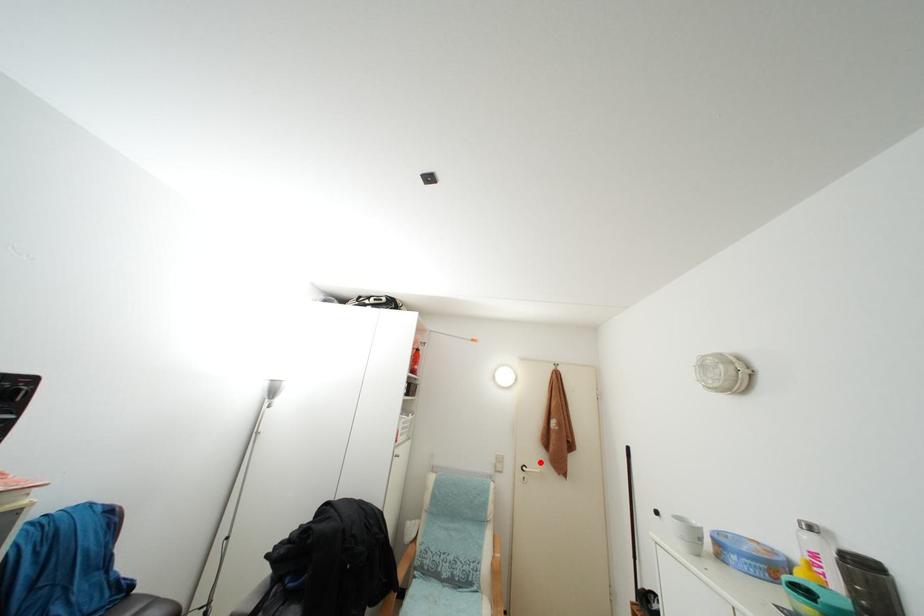
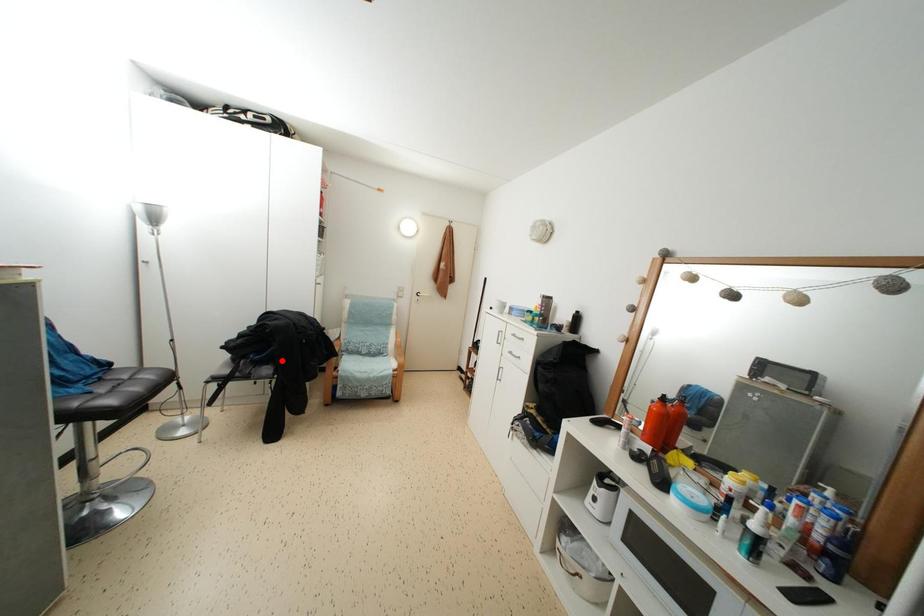
I am providing you with two images of the same scene from different viewpoints. A red point is marked on the first image and another point is marked on the second image. Are the points marked in image1 and image2 representing the same 3D position?

No